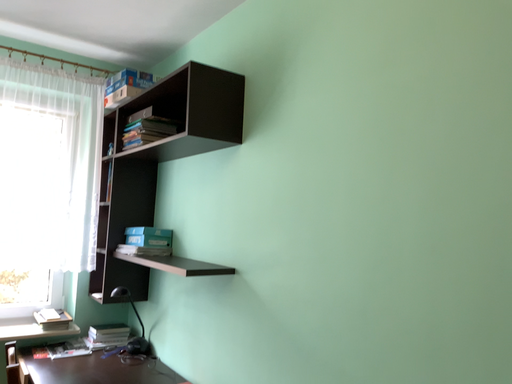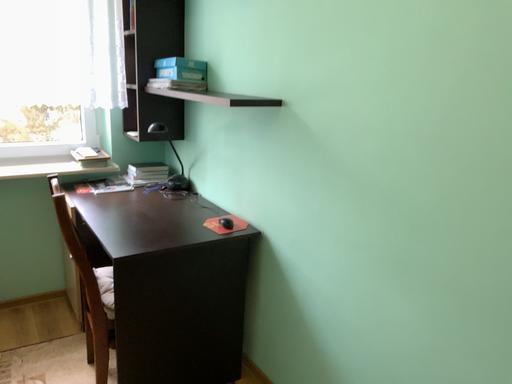
Question: How did the camera likely rotate when shooting the video?

Choices:
 (A) rotated downward
 (B) rotated upward

Answer: (A)